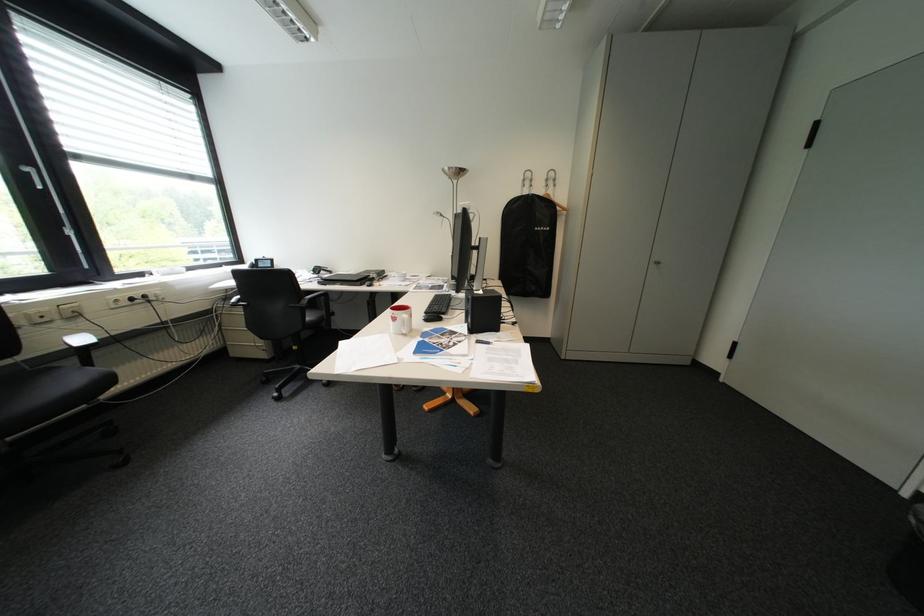
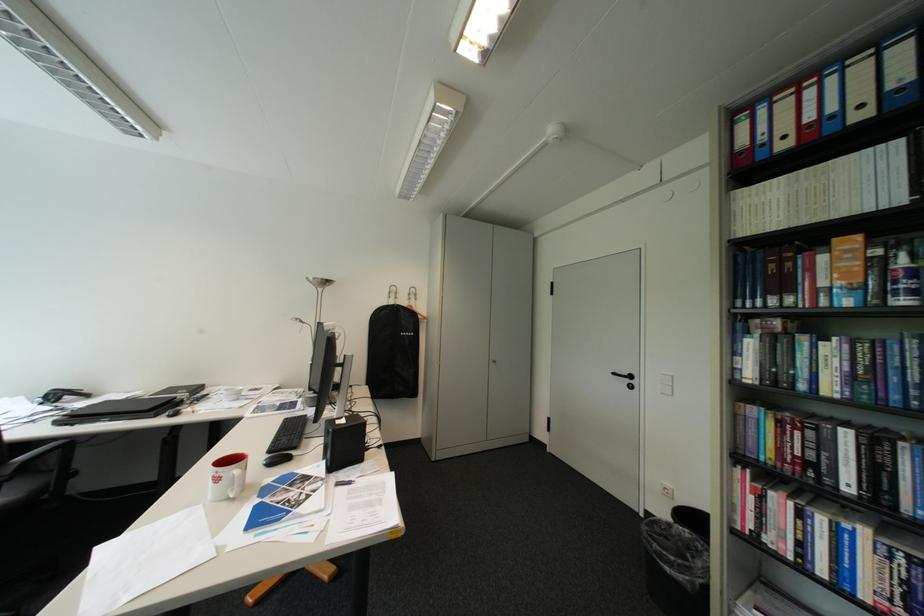
In the second image, find the point that corresponds to point (529, 192) in the first image.

(395, 302)